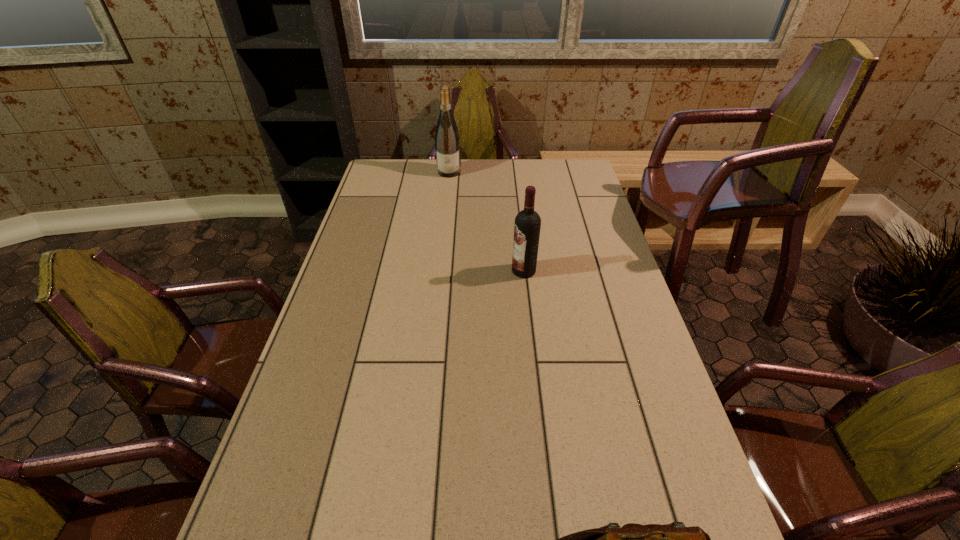
Find the location of a particular element. Image resolution: width=960 pixels, height=540 pixels. vacant position at the left edge of the desktop is located at coordinates (396, 221).

In the image, there is a desktop. Find the location of `free region at the right edge`. free region at the right edge is located at coordinates (598, 299).

Where is `free location at the far left corner of the desktop`? free location at the far left corner of the desktop is located at coordinates (404, 163).

Locate an element on the screen. This screenshot has width=960, height=540. unoccupied position between the farther wine bottle and the second farthest object is located at coordinates (487, 221).

You are a GUI agent. You are given a task and a screenshot of the screen. Output one action in this format:
    pyautogui.click(x=<x>, y=<y>)
    Task: Click on the vacant region between the nearer wine bottle and the farther wine bottle
    The width and height of the screenshot is (960, 540).
    Given the screenshot: What is the action you would take?
    pyautogui.click(x=487, y=221)

Locate an element on the screen. The height and width of the screenshot is (540, 960). free space between the farther wine bottle and the nearer wine bottle is located at coordinates click(x=487, y=221).

At what (x,y) coordinates should I click in order to perform the action: click on free area in between the shorter wine bottle and the taller wine bottle. Please return your answer as a coordinate pair (x, y). The height and width of the screenshot is (540, 960). Looking at the image, I should click on (487, 221).

You are a GUI agent. You are given a task and a screenshot of the screen. Output one action in this format:
    pyautogui.click(x=<x>, y=<y>)
    Task: Click on the free space that is in between the left wine bottle and the second nearest object
    This screenshot has height=540, width=960.
    Given the screenshot: What is the action you would take?
    pyautogui.click(x=487, y=221)

Find the location of a particular element. free spot between the left wine bottle and the second farthest object is located at coordinates (487, 221).

Locate an element on the screen. object that is the second closest to the shoulder bag is located at coordinates (447, 140).